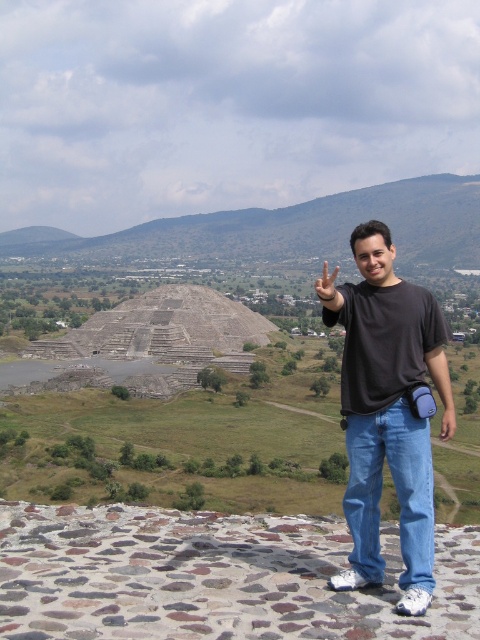
In the scene shown: How far apart are gray stone pyramid at center-left and white matte hand at upper center?

gray stone pyramid at center-left and white matte hand at upper center are 596.17 feet apart.

Is gray stone pyramid at center-left to the right of white matte hand at upper center from the viewer's perspective?

Incorrect, gray stone pyramid at center-left is not on the right side of white matte hand at upper center.

The image size is (480, 640). Describe the element at coordinates (155, 340) in the screenshot. I see `gray stone pyramid at center-left` at that location.

Find the location of `gray stone pyramid at center-left`. gray stone pyramid at center-left is located at coordinates (155, 340).

Which is behind, point (330, 276) or point (453, 433)?

Point (330, 276)

Can you confirm if white matte hand at upper center is bigger than matte black hand at center?

Correct, white matte hand at upper center is larger in size than matte black hand at center.

Find the location of a particular element. Image resolution: width=480 pixels, height=640 pixels. white matte hand at upper center is located at coordinates (327, 288).

Can you confirm if green grassy hill at upper center is wider than matte black hand at center?

Indeed, green grassy hill at upper center has a greater width compared to matte black hand at center.

Which is more to the left, green grassy hill at upper center or matte black hand at center?

green grassy hill at upper center is more to the left.

Is point (202, 244) behind point (444, 432)?

Yes, point (202, 244) is behind point (444, 432).

Find the location of a particular element. green grassy hill at upper center is located at coordinates (290, 228).